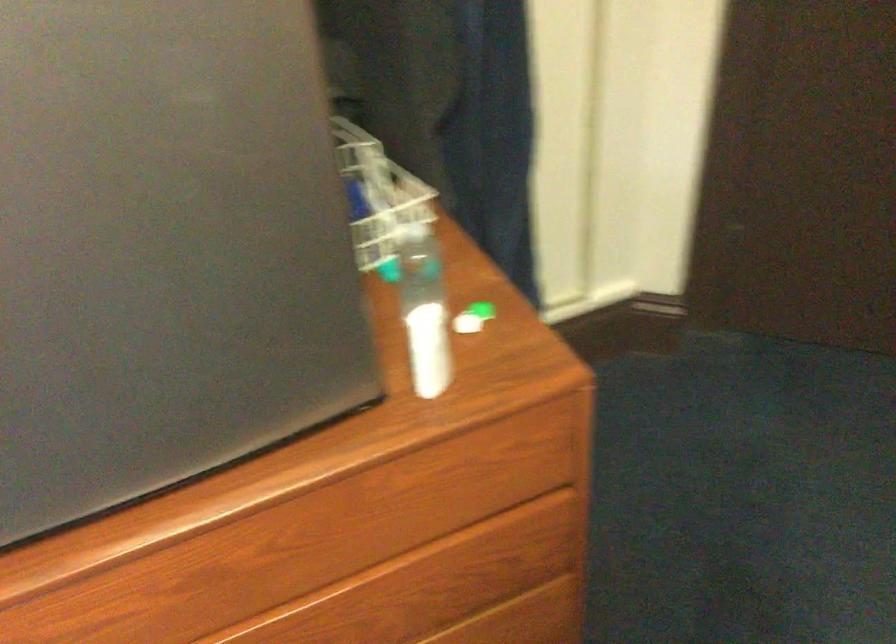
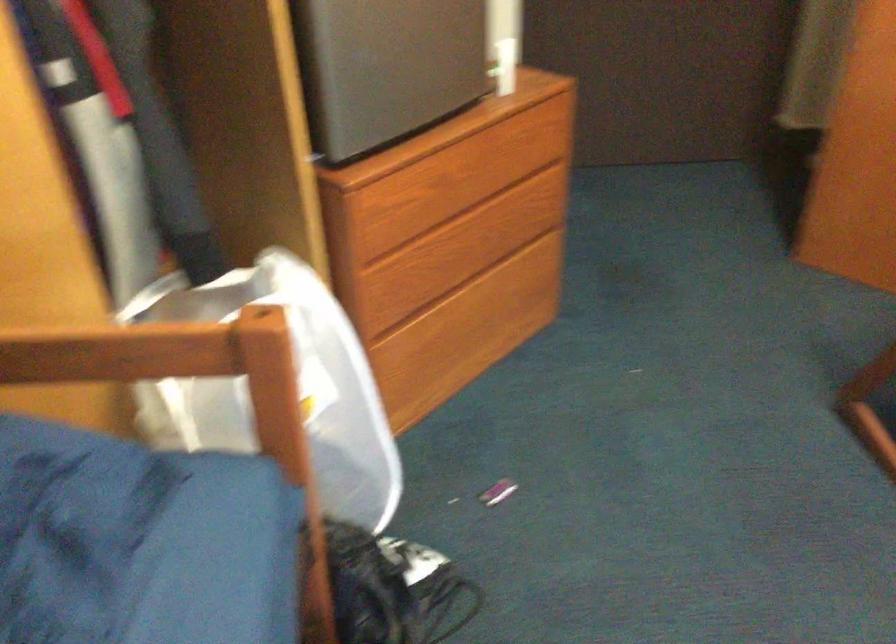
Where in the second image is the point corresponding to pixel 286 520 from the first image?

(462, 152)